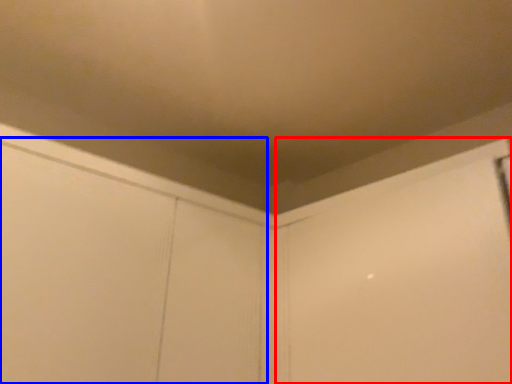
Question: Which object appears farthest to the camera in this image, screen door (highlighted by a red box) or screen door (highlighted by a blue box)?

Choices:
 (A) screen door
 (B) screen door

Answer: (A)